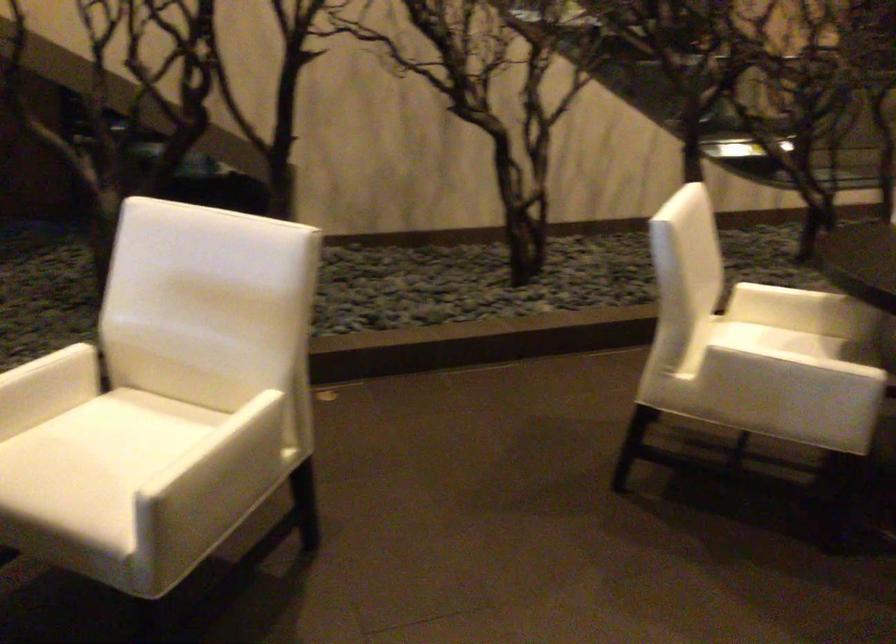
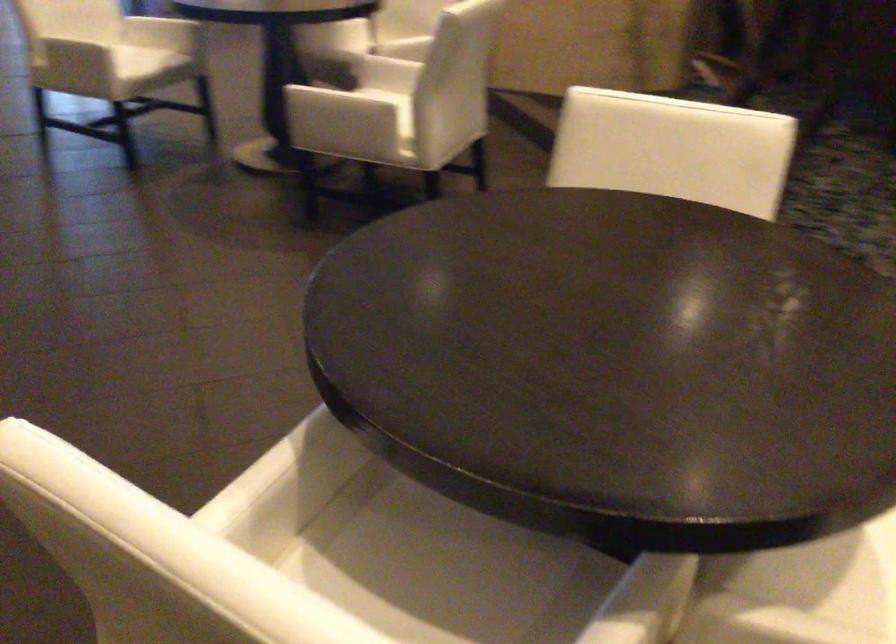
Locate, in the second image, the point that corresponds to [280,438] in the first image.

(371, 109)